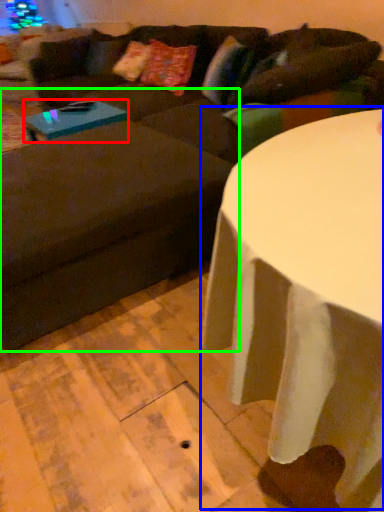
Question: Considering the real-world distances, which object is closest to coffee table (highlighted by a red box)? table (highlighted by a blue box) or swivel chair (highlighted by a green box).

Choices:
 (A) table
 (B) swivel chair

Answer: (B)